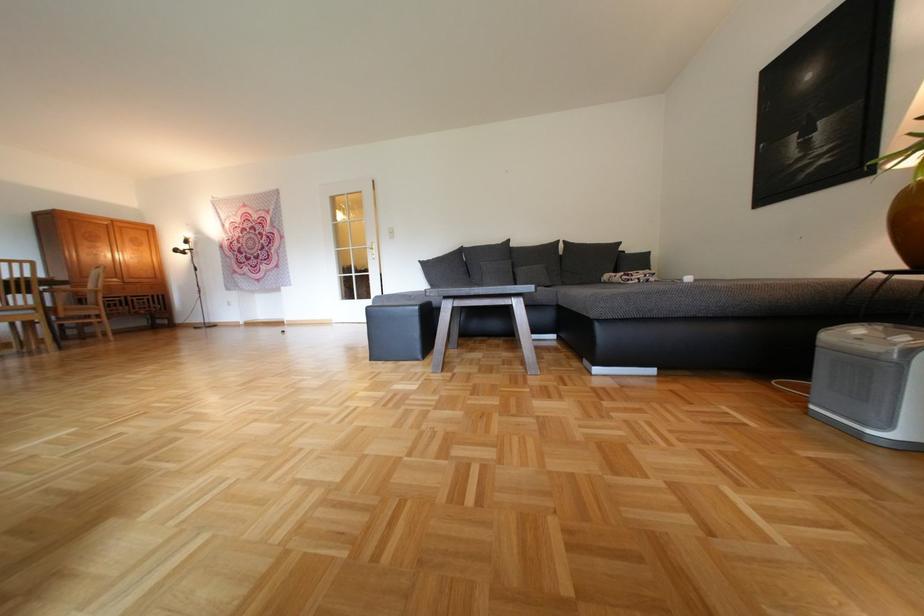
Image resolution: width=924 pixels, height=616 pixels. I want to click on brass door handle, so click(371, 251).